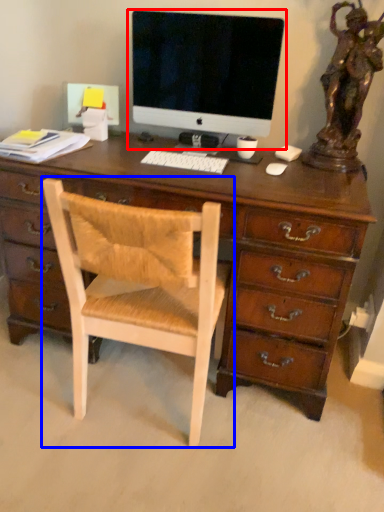
Question: Which of the following is the closest to the observer, computer monitor (highlighted by a red box) or chair (highlighted by a blue box)?

Choices:
 (A) computer monitor
 (B) chair

Answer: (B)